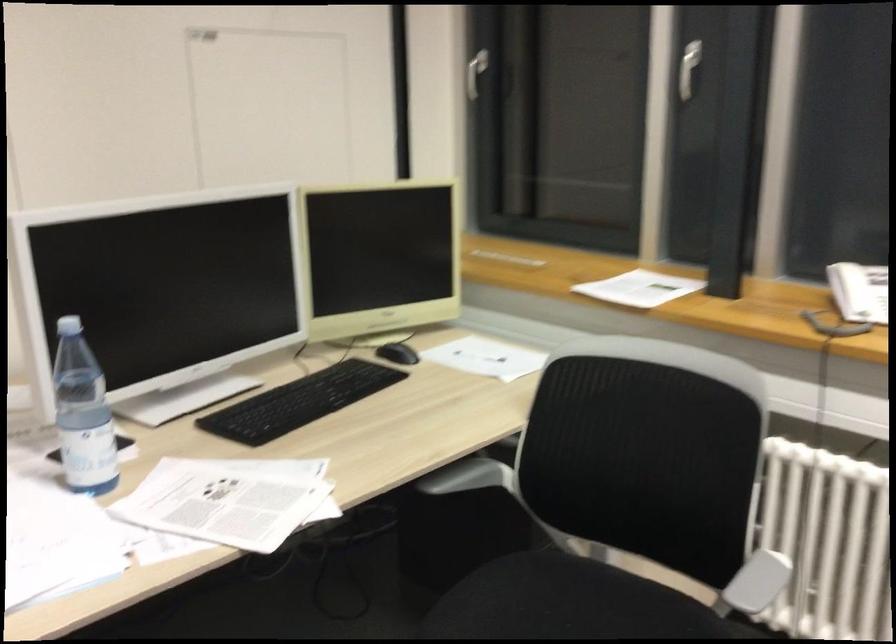
Find where to twist the blue bottle cap. Please return your answer as a coordinate pair (x, y).

(82, 413)